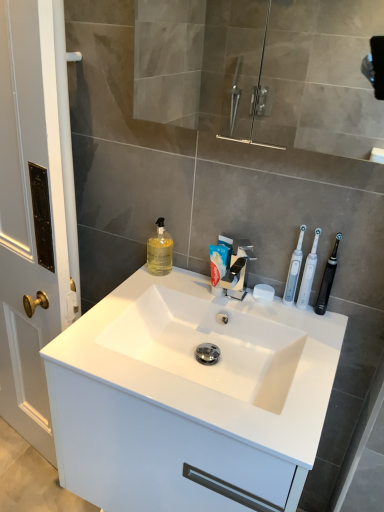
Question: Looking at their shapes, would you say translucent yellow liquid at sink left is wider or thinner than white plastic toothbrushes at right, which is the third toothbrush in right-to-left order?

Choices:
 (A) thin
 (B) wide

Answer: (B)

Question: From the image's perspective, relative to white plastic toothbrushes at right, which is the 1th toothbrush in left-to-right order, is translucent yellow liquid at sink left above or below?

Choices:
 (A) above
 (B) below

Answer: (A)

Question: Which of these objects is positioned farthest from the white plastic toothbrushes at right, which is the 1th toothbrush in left-to-right order?

Choices:
 (A) transparent glass mirror at upper center
 (B) white glossy cabinet at center
 (C) white matte toothpaste at center
 (D) white matte soap at center
 (E) polished chrome faucet at center

Answer: (A)

Question: Estimate the real-world distances between objects in this image. Which object is farther from the white plastic toothbrushes at right, which is the third toothbrush in right-to-left order?

Choices:
 (A) polished chrome faucet at center
 (B) translucent yellow liquid at sink left
 (C) white matte soap at center
 (D) white glossy cabinet at center
 (E) white plastic toothbrush at right, the 2th toothbrush in the right-to-left sequence

Answer: (D)